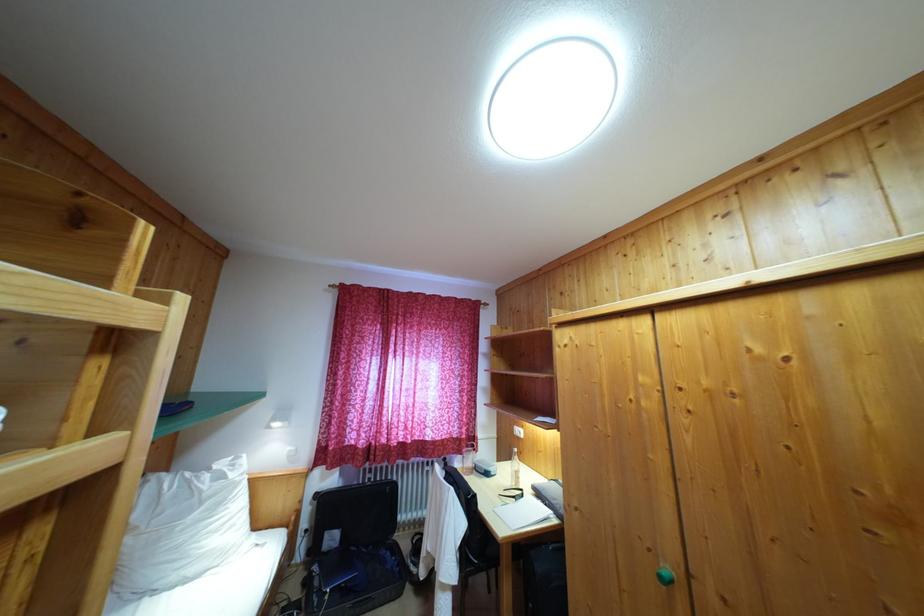
The height and width of the screenshot is (616, 924). What are the coordinates of `white light switch` in the screenshot? It's located at (517, 431).